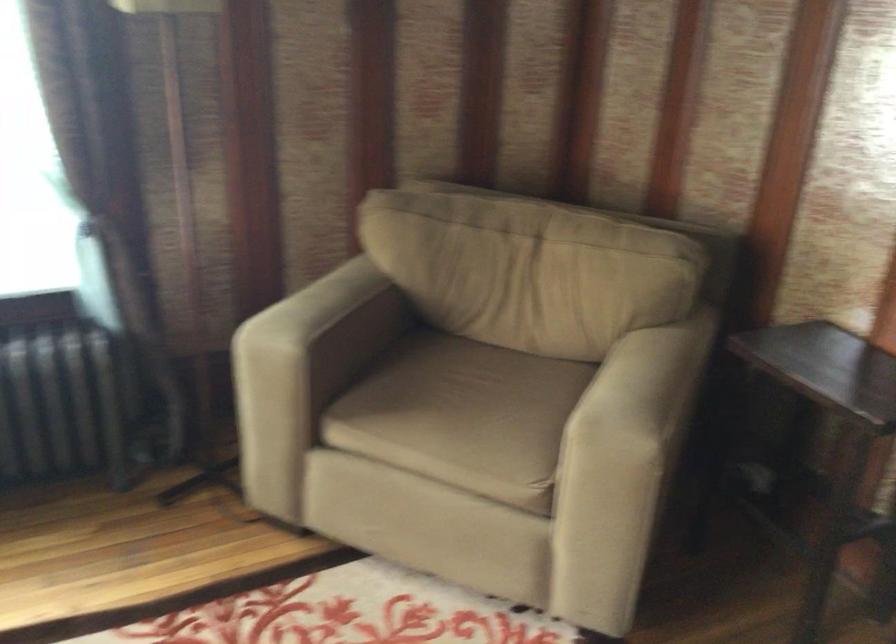
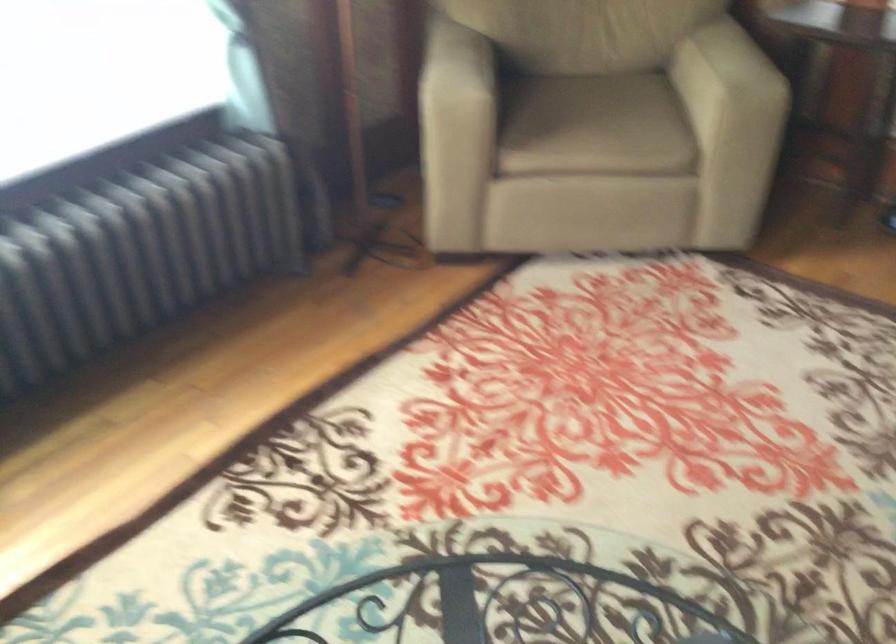
Question: What movement of the cameraman would produce the second image?

Choices:
 (A) Left
 (B) Right
 (C) Forward
 (D) Backward

Answer: (A)